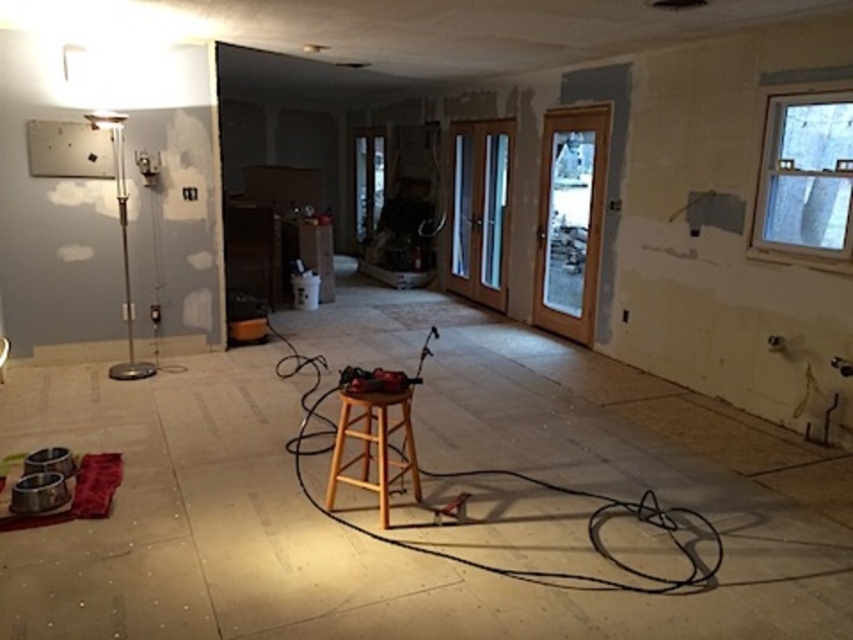
You are a construction worker carrying a tool box that is 18 inches wide. You need to move from the black cable at center to the wooden bar stool at center. Can you fit through the space between them?

The distance between the black cable at center and the wooden bar stool at center is 22.22 inches, which is wider than your tool box of 18 inches. Therefore, you can fit through the space between them.

You are a construction worker who needs to move the wooden bar stool at center to another area. However, you must ensure that the black cable at center is not damaged during the move. Given the spatial relationship between the two, can you move the stool without moving the cable?

The black cable at center is shorter than the wooden bar stool at center. Therefore, moving the stool might require adjusting the cable, but since the cable is shorter, it may not have enough length to allow the stool to be moved without pulling or stretching the cable, potentially causing damage. It is advisable to first relocate the cable or ensure it is secured before moving the stool.